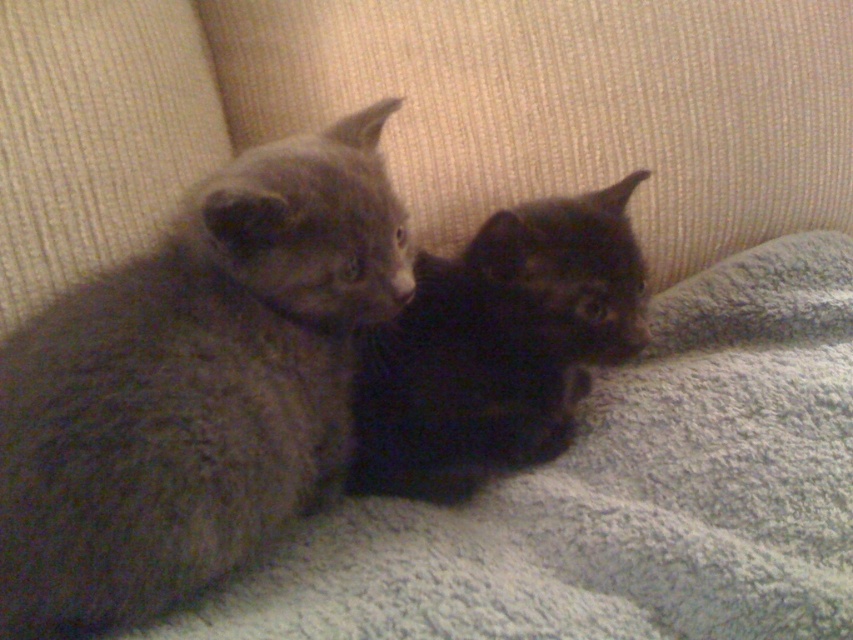
Question: Which of the following is the closest to the observer?

Choices:
 (A) click(x=316, y=435)
 (B) click(x=575, y=214)

Answer: (A)

Question: Among these objects, which one is nearest to the camera?

Choices:
 (A) black fuzzy cat at center
 (B) soft gray fur kitten at left

Answer: (B)

Question: Does soft gray fur kitten at left come in front of black fuzzy cat at center?

Choices:
 (A) no
 (B) yes

Answer: (B)

Question: Considering the relative positions of soft gray fur kitten at left and black fuzzy cat at center in the image provided, where is soft gray fur kitten at left located with respect to black fuzzy cat at center?

Choices:
 (A) above
 (B) below

Answer: (B)

Question: Does soft gray fur kitten at left have a lesser width compared to black fuzzy cat at center?

Choices:
 (A) no
 (B) yes

Answer: (A)